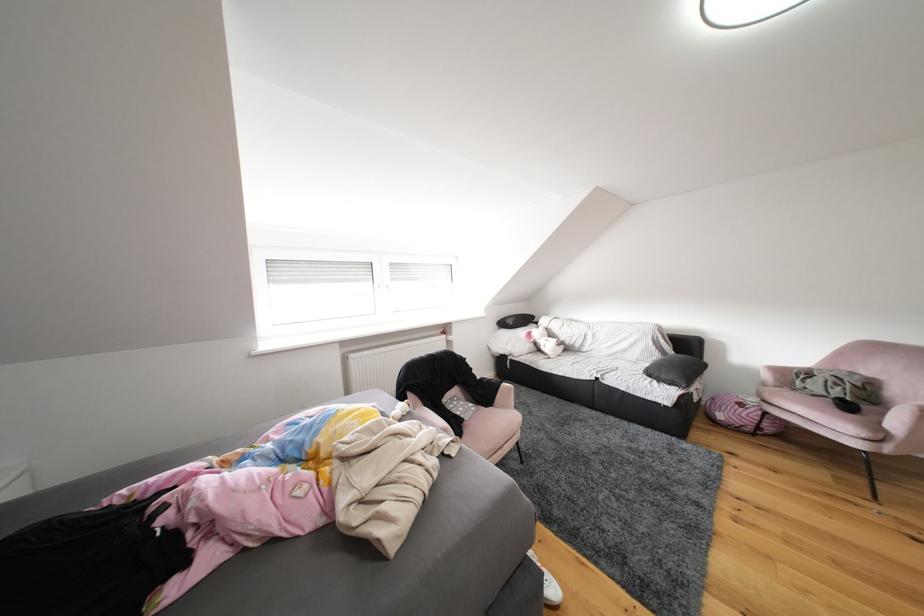
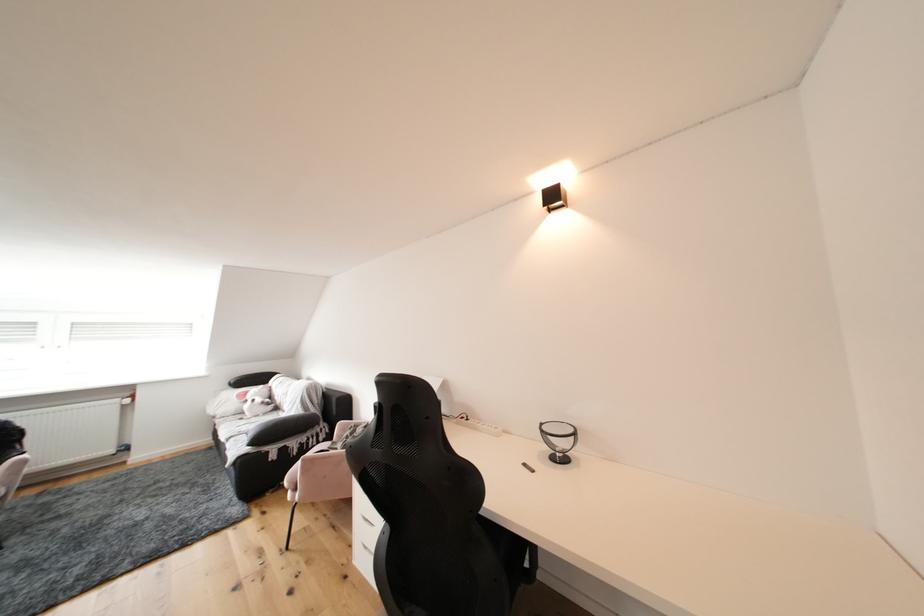
Where in the second image is the point corresponding to pixel 539 338 from the first image?

(256, 397)